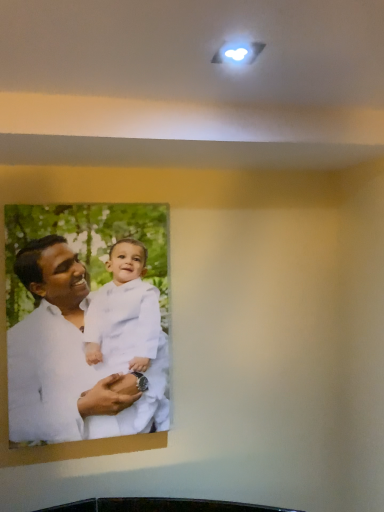
This screenshot has height=512, width=384. What do you see at coordinates (64, 325) in the screenshot?
I see `white paper photo at center` at bounding box center [64, 325].

This screenshot has width=384, height=512. Identify the location of white paper photo at center. (64, 325).

Measure the distance between white paper photo at center and camera.

white paper photo at center is 4.40 feet from camera.

Locate an element on the screen. The image size is (384, 512). white paper photo at center is located at coordinates (64, 325).